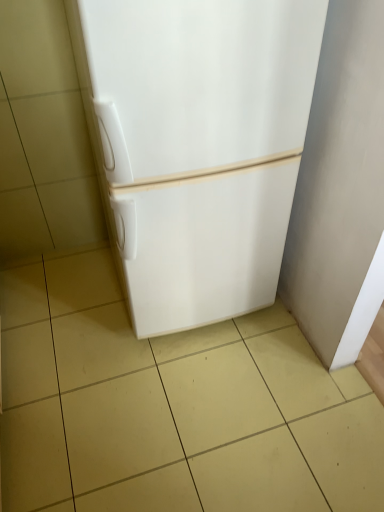
Find the location of a particular element. This screenshot has height=512, width=384. white matte refrigerator at center is located at coordinates (200, 145).

Describe the element at coordinates (200, 145) in the screenshot. I see `white matte refrigerator at center` at that location.

Identify the location of white matte refrigerator at center. (200, 145).